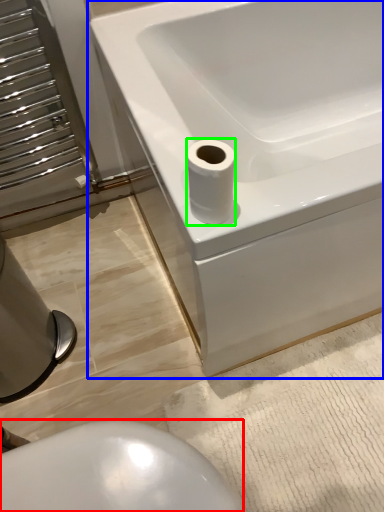
Question: Which object is the farthest from bidet (highlighted by a red box)? Choose among these: bathtub (highlighted by a blue box) or toilet paper (highlighted by a green box).

Choices:
 (A) bathtub
 (B) toilet paper

Answer: (A)